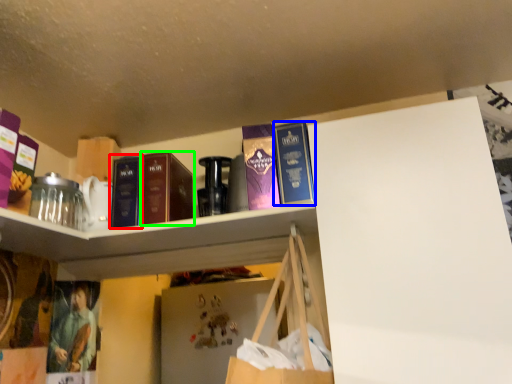
Question: Which is farther away from book (highlighted by a red box)? book (highlighted by a blue box) or book (highlighted by a green box)?

Choices:
 (A) book
 (B) book

Answer: (A)